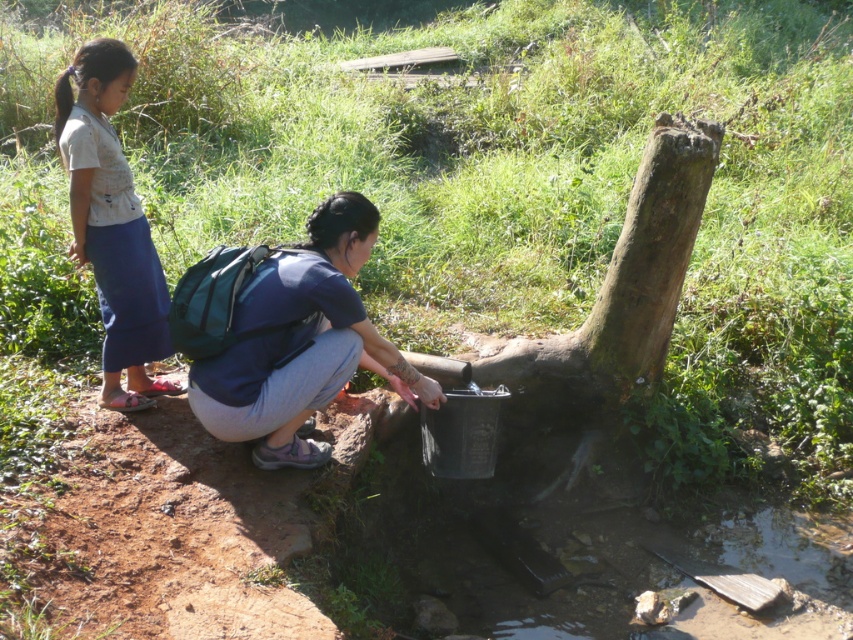
Does blue fabric backpack at center appear over green mossy tree trunk at center?

No.

Between point (238, 436) and point (566, 356), which one is positioned in front?

Point (238, 436) is more forward.

At what (x,y) coordinates should I click in order to perform the action: click on blue fabric backpack at center. Please return your answer as a coordinate pair (x, y). The image size is (853, 640). Looking at the image, I should click on (300, 342).

Does green mossy tree trunk at center appear on the right side of light blue denim skirt at left?

Indeed, green mossy tree trunk at center is positioned on the right side of light blue denim skirt at left.

Is green mossy tree trunk at center above light blue denim skirt at left?

Incorrect, green mossy tree trunk at center is not positioned above light blue denim skirt at left.

Is point (637, 177) less distant than point (129, 266)?

No, it is not.

Image resolution: width=853 pixels, height=640 pixels. I want to click on green mossy tree trunk at center, so click(x=621, y=288).

Does blue fabric backpack at center have a greater width compared to light blue denim skirt at left?

Correct, the width of blue fabric backpack at center exceeds that of light blue denim skirt at left.

Which is in front, point (323, 289) or point (73, 61)?

Point (323, 289) is more forward.

Which is behind, point (337, 252) or point (160, 339)?

Positioned behind is point (160, 339).

You are a GUI agent. You are given a task and a screenshot of the screen. Output one action in this format:
    pyautogui.click(x=<x>, y=<y>)
    Task: Click on the blue fabric backpack at center
    Image resolution: width=853 pixels, height=640 pixels.
    Given the screenshot: What is the action you would take?
    pyautogui.click(x=300, y=342)